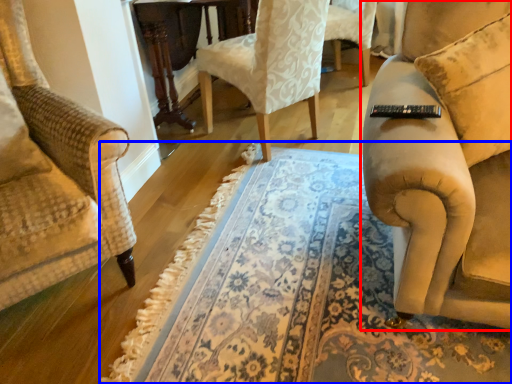
Question: Which point is closer to the camera, studio couch (highlighted by a red box) or mat (highlighted by a blue box)?

Choices:
 (A) studio couch
 (B) mat

Answer: (B)